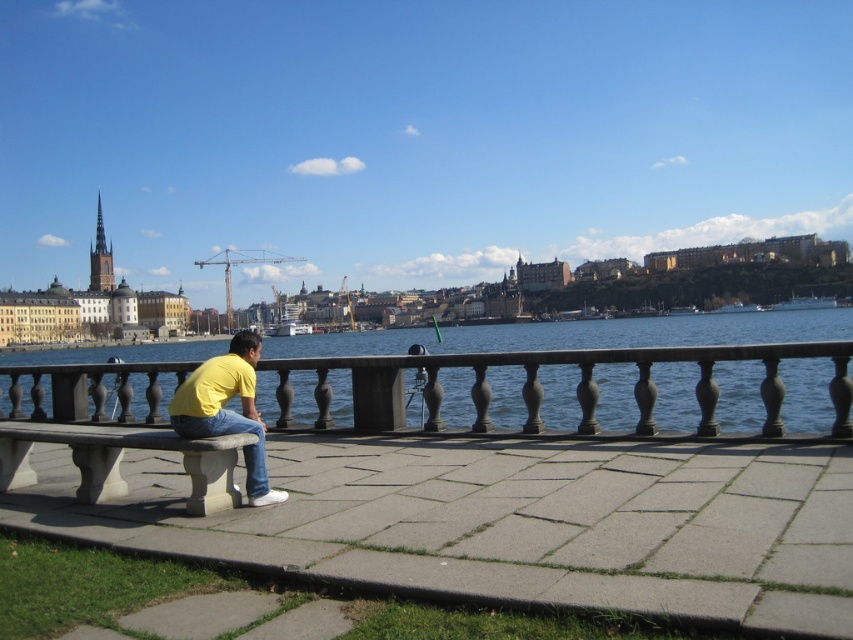
Question: Is blue water at center positioned in front of gray stone bench at lower left?

Choices:
 (A) no
 (B) yes

Answer: (A)

Question: Is gray stone bench at lower left closer to camera compared to yellow matte shirt at center?

Choices:
 (A) yes
 (B) no

Answer: (B)

Question: Is blue water at center closer to camera compared to yellow matte shirt at center?

Choices:
 (A) yes
 (B) no

Answer: (B)

Question: Which of the following is the farthest from the observer?

Choices:
 (A) (260, 433)
 (B) (206, 499)

Answer: (A)

Question: Which of the following is the farthest from the observer?

Choices:
 (A) yellow matte shirt at center
 (B) blue water at center

Answer: (B)

Question: Which of the following is the closest to the observer?

Choices:
 (A) yellow matte shirt at center
 (B) gray stone bench at lower left

Answer: (A)